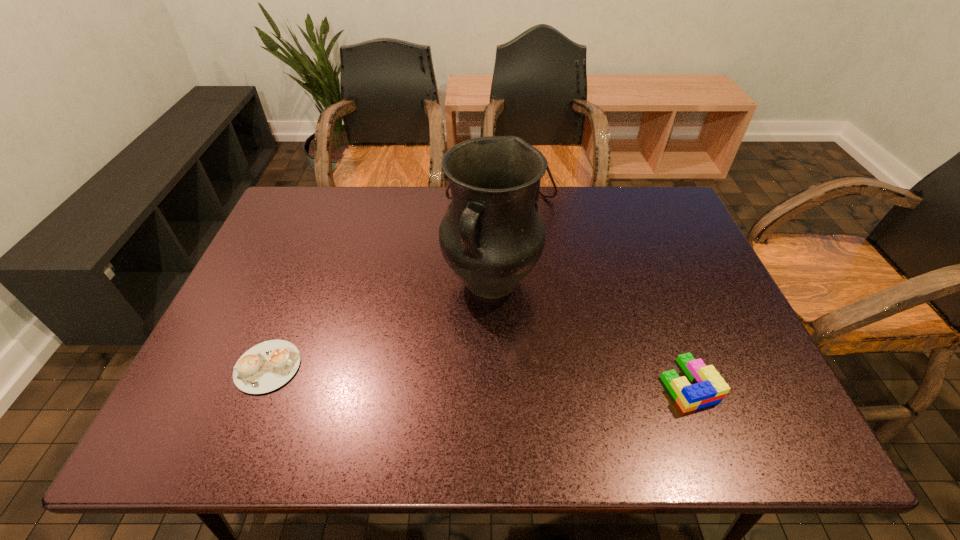
Find the location of a particular element. object positioned at the right edge is located at coordinates (708, 388).

I want to click on object at the near left corner, so click(x=266, y=366).

This screenshot has height=540, width=960. What are the coordinates of `object situated at the near right corner` in the screenshot? It's located at (708, 388).

Locate an element on the screen. free space at the far edge is located at coordinates (361, 223).

Where is `vacant region at the near edge of the desktop`? The height and width of the screenshot is (540, 960). vacant region at the near edge of the desktop is located at coordinates (437, 369).

Locate an element on the screen. The height and width of the screenshot is (540, 960). vacant space at the left edge of the desktop is located at coordinates (226, 356).

Image resolution: width=960 pixels, height=540 pixels. Identify the location of free space at the right edge of the desktop. (694, 254).

Find the location of a particular element. The image size is (960, 540). vacant space at the far left corner is located at coordinates (316, 188).

Locate an element on the screen. Image resolution: width=960 pixels, height=540 pixels. vacant area between the Lego and the shortest object is located at coordinates (478, 375).

Locate an element on the screen. The height and width of the screenshot is (540, 960). vacant area that lies between the tallest object and the Lego is located at coordinates (589, 333).